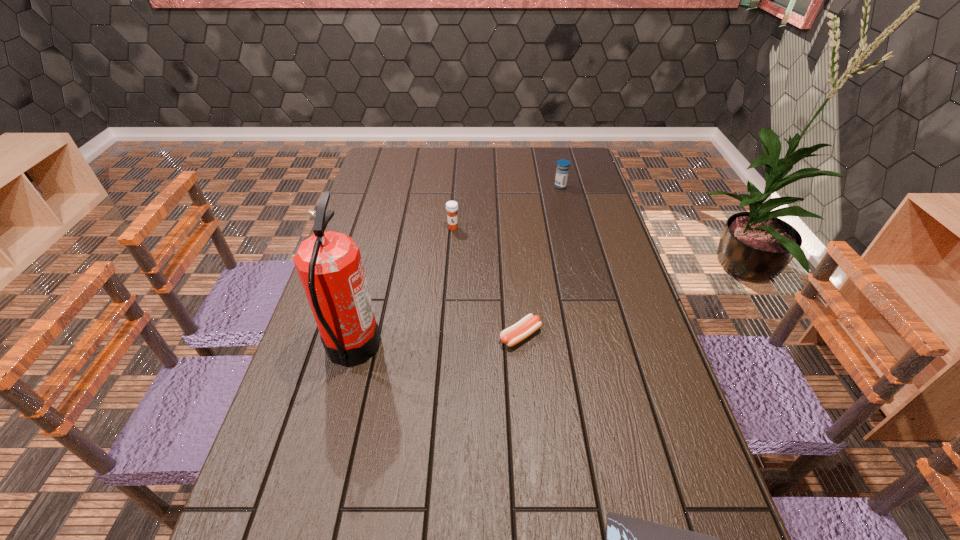
You are a GUI agent. You are given a task and a screenshot of the screen. Output one action in this format:
    pyautogui.click(x=<x>, y=<y>)
    Task: Click on the vacant space located 0.400m on the label side of the second farthest object
    This screenshot has width=960, height=540.
    Given the screenshot: What is the action you would take?
    coord(446,320)

Locate an element on the screen. This screenshot has height=540, width=960. free space located 0.110m on the back of the second shortest object is located at coordinates (517, 293).

Locate an element on the screen. The height and width of the screenshot is (540, 960). object that is at the left edge is located at coordinates (329, 264).

Where is `object situated at the right edge`? This screenshot has width=960, height=540. object situated at the right edge is located at coordinates (562, 171).

At what (x,y) coordinates should I click in order to perform the action: click on vacant space at the far edge of the desktop. Please return your answer as a coordinate pair (x, y). Image resolution: width=960 pixels, height=540 pixels. Looking at the image, I should click on (521, 161).

The height and width of the screenshot is (540, 960). I want to click on vacant space at the left edge, so click(x=372, y=184).

In the image, there is a desktop. Identify the location of free space at the right edge. (627, 449).

Identify the location of free space at the far left corner of the desktop. (396, 153).

In the image, there is a desktop. Where is `vacant space at the far right corner`? This screenshot has height=540, width=960. vacant space at the far right corner is located at coordinates (576, 170).

Locate an element on the screen. unoccupied position between the second shortest object and the right medicine is located at coordinates (540, 261).